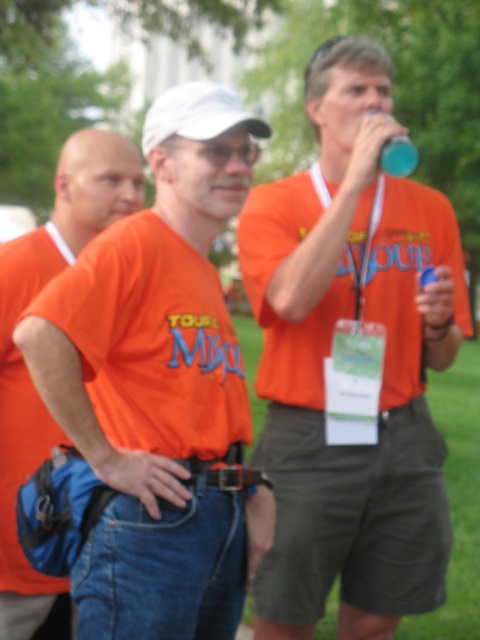
Is orange cotton shirt at center further to camera compared to blue plastic cup at upper center?

No, orange cotton shirt at center is closer to the viewer.

Is orange cotton shirt at center bigger than blue plastic cup at upper center?

Correct, orange cotton shirt at center is larger in size than blue plastic cup at upper center.

You are a GUI agent. You are given a task and a screenshot of the screen. Output one action in this format:
    pyautogui.click(x=<x>, y=<y>)
    Task: Click on the orange cotton shirt at center
    This screenshot has height=640, width=480.
    Given the screenshot: What is the action you would take?
    pyautogui.click(x=158, y=385)

Is matte orange shirt at center to the left of blue plastic cup at upper center from the viewer's perspective?

Yes, matte orange shirt at center is to the left of blue plastic cup at upper center.

Between point (405, 436) and point (396, 163), which one is positioned behind?

The point (405, 436) is more distant.

Is point (456, 225) positioned after point (416, 164)?

That is True.

Image resolution: width=480 pixels, height=640 pixels. What are the coordinates of `matte orange shirt at center` in the screenshot? It's located at tap(328, 355).

Is point (156, 404) farther from camera compared to point (3, 404)?

That is False.

Is orange cotton shirt at center below orange cotton shirt at left?

No.

Is point (193, 451) closer to viewer compared to point (23, 304)?

Yes, it is.

This screenshot has height=640, width=480. Find the location of `orange cotton shirt at center`. orange cotton shirt at center is located at coordinates coord(158,385).